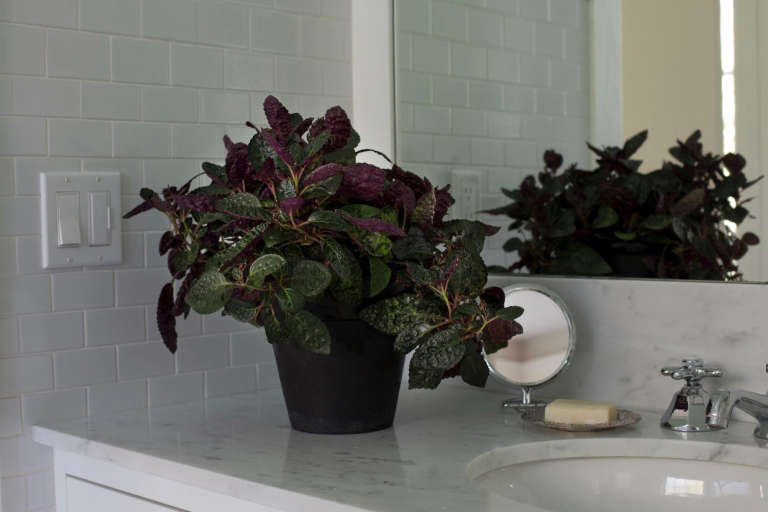
Where is `on switch`? The image size is (768, 512). on switch is located at coordinates (74, 202).